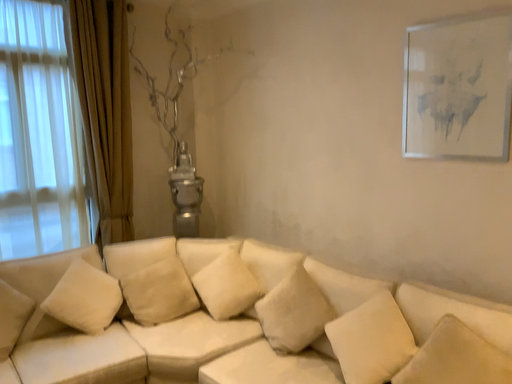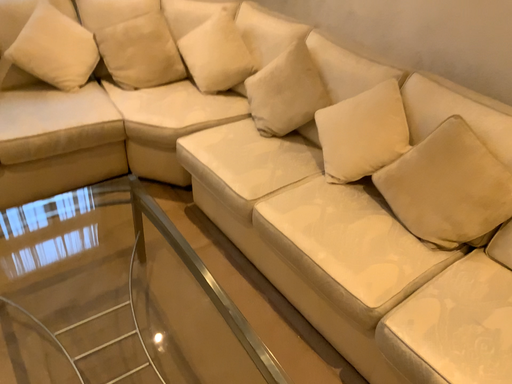
Question: How did the camera likely rotate when shooting the video?

Choices:
 (A) rotated downward
 (B) rotated upward

Answer: (A)